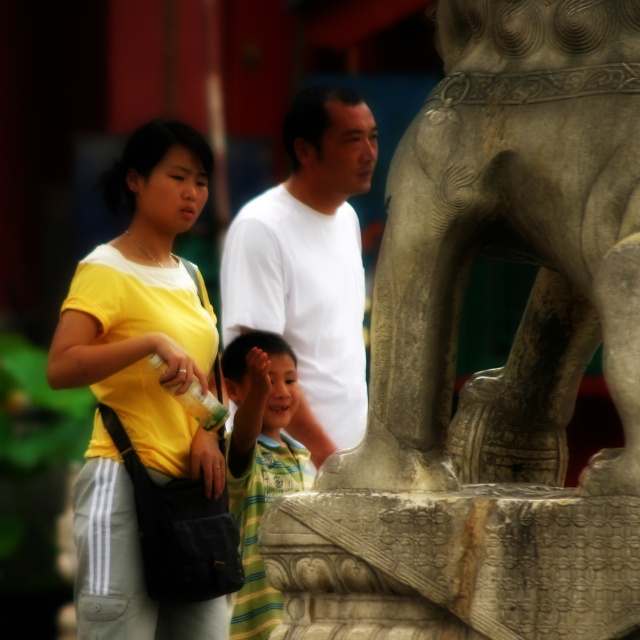
You are a photographer trying to capture a group photo of the two adults in the scene. The camera you are using has a limited focus range. Since the adults are wearing yellow matte shirt at center and striped cotton shirt at center, which one is wider so that you can ensure proper focus?

The yellow matte shirt at center is wider than the striped cotton shirt at center, so you should focus on the yellow matte shirt at center to ensure proper focus.